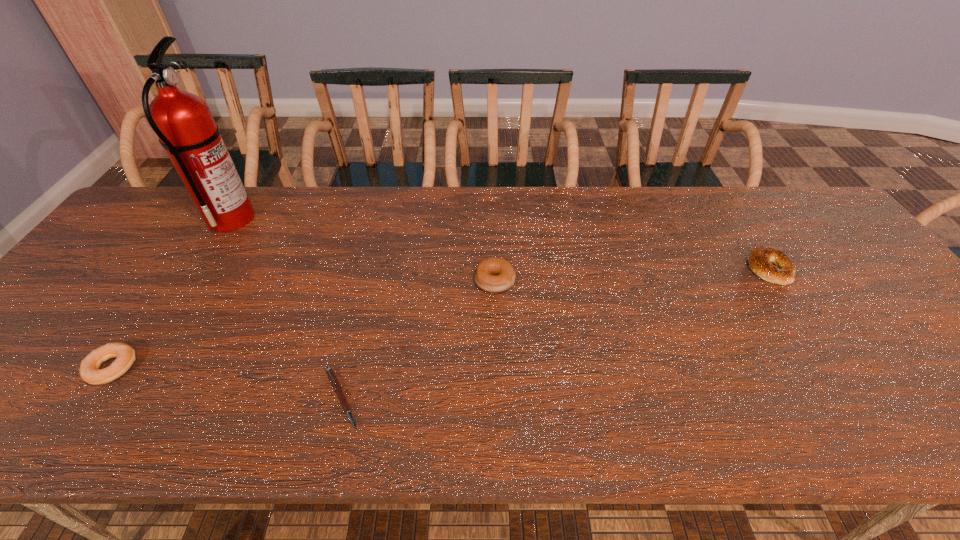
You are a GUI agent. You are given a task and a screenshot of the screen. Output one action in this format:
    pyautogui.click(x=<x>, y=<y>)
    Task: Click on the free space located 0.080m on the back of the rightmost object
    The height and width of the screenshot is (540, 960).
    Given the screenshot: What is the action you would take?
    pyautogui.click(x=747, y=233)

Where is `vacant region located 0.280m on the back of the nearest bagel`? The image size is (960, 540). vacant region located 0.280m on the back of the nearest bagel is located at coordinates (182, 264).

Where is `blank space located 0.190m at the nib of the third object from left to right`? blank space located 0.190m at the nib of the third object from left to right is located at coordinates pos(454,398).

The width and height of the screenshot is (960, 540). Identify the location of object present at the far edge. tap(186, 129).

Where is `object at the near edge`? This screenshot has height=540, width=960. object at the near edge is located at coordinates (330, 373).

In the image, there is a desktop. In order to click on vacant space at the far edge in this screenshot , I will do `click(357, 204)`.

The width and height of the screenshot is (960, 540). I want to click on vacant region at the near edge of the desktop, so click(756, 403).

The width and height of the screenshot is (960, 540). In order to click on vacant space at the left edge in this screenshot , I will do `click(12, 386)`.

I want to click on vacant space at the far right corner, so click(809, 215).

Where is `free space at the near right corner`? free space at the near right corner is located at coordinates [x=951, y=411].